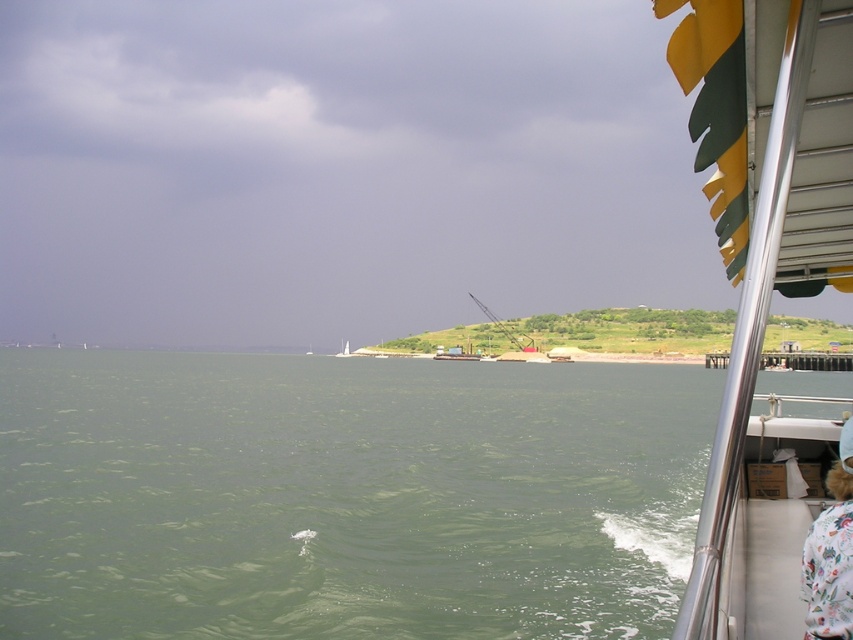
You are a photographer standing on the deck of a ferry and want to capture a photo of both the green water at lower left and the metallic silver boat at right. Given that your camera has a maximum zoom range of 50 meters, will you be able to frame both subjects in a single shot without moving your position?

The distance between the green water at lower left and the metallic silver boat at right is 42.95 meters, which is within the camera maximum zoom range of 50 meters. Therefore, you can frame both subjects in a single shot without moving your position.

You are standing on the boat and want to place your fluffy fur coat at lower right on the railing. However, you notice the green water at lower left is much taller than the coat. What does this mean about the railing height compared to the coat?

The green water at lower left is much taller than the fluffy fur coat at lower right, which means the railing height is lower than the coat. Therefore, the railing might not be tall enough to safely place the coat there.